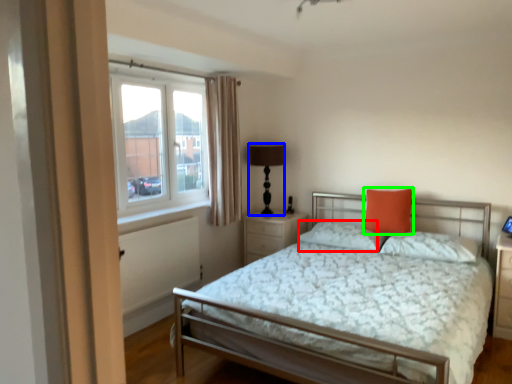
Question: Which object is positioned closest to pillow (highlighted by a red box)? Select from table lamp (highlighted by a blue box) and pillow (highlighted by a green box).

Choices:
 (A) table lamp
 (B) pillow

Answer: (B)